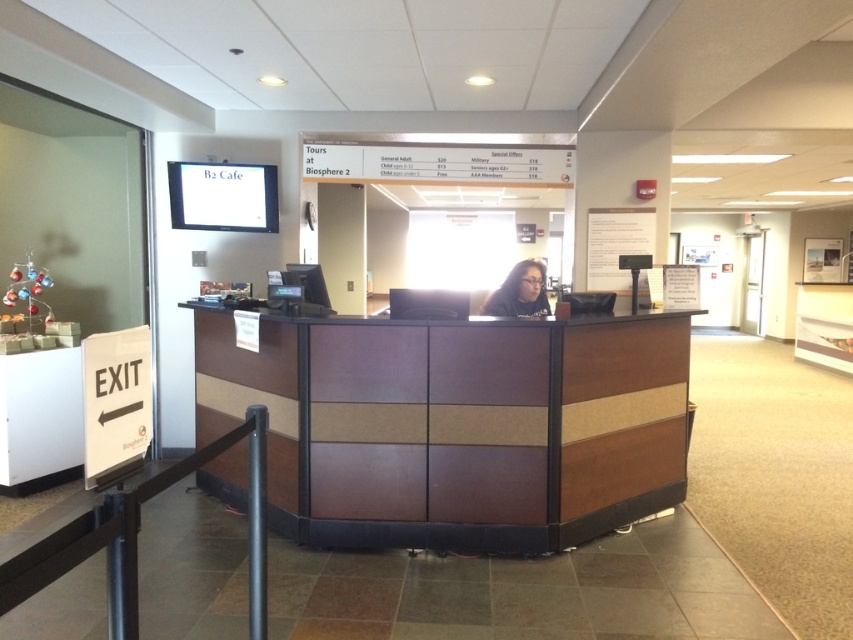
Question: Where is brown wood/paneling information desk at center located in relation to black metal/rail at lower left in the image?

Choices:
 (A) left
 (B) right

Answer: (B)

Question: Can you confirm if black metal/rail at lower left is positioned to the right of white paper at upper right?

Choices:
 (A) yes
 (B) no

Answer: (B)

Question: Which object appears closest to the camera in this image?

Choices:
 (A) brown wood/paneling information desk at center
 (B) black metal/rail at lower left

Answer: (B)

Question: Which of the following is the closest to the observer?

Choices:
 (A) (207, 465)
 (B) (595, 243)

Answer: (A)

Question: Which point is farther from the camera taking this photo?

Choices:
 (A) (619, 280)
 (B) (497, 296)
 (C) (195, 464)
 (D) (431, 413)

Answer: (A)

Question: Does brown wood/paneling information desk at center have a smaller size compared to white paper at upper right?

Choices:
 (A) no
 (B) yes

Answer: (A)